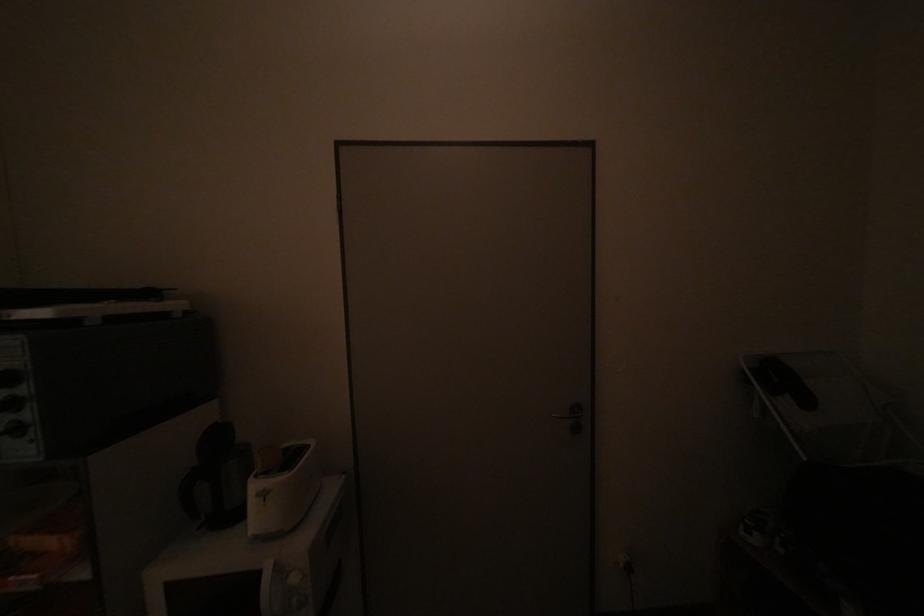
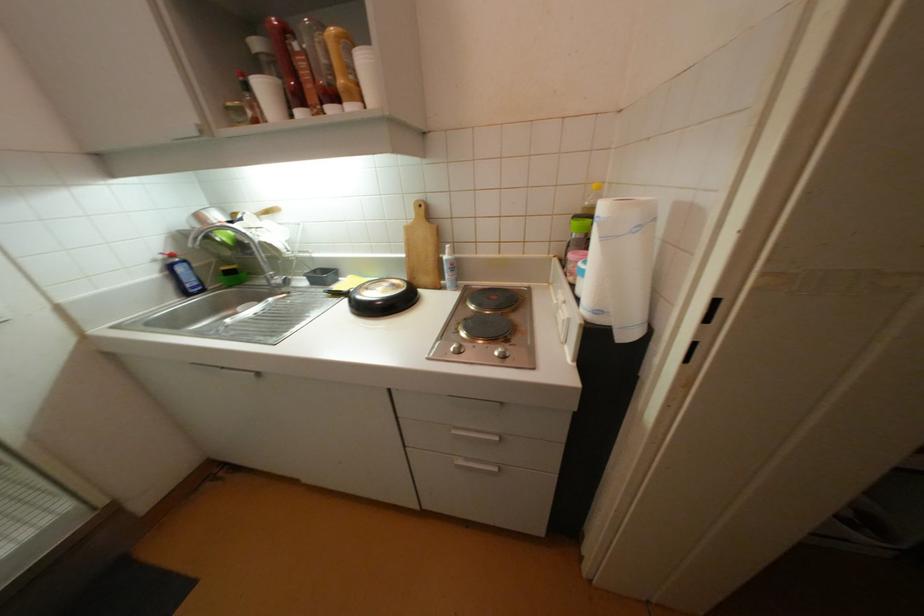
Question: Which direction would the cameraman need to move to produce the second image? Reply with the corresponding letter.

Choices:
 (A) Left
 (B) Right
 (C) Forward
 (D) Backward

Answer: (A)